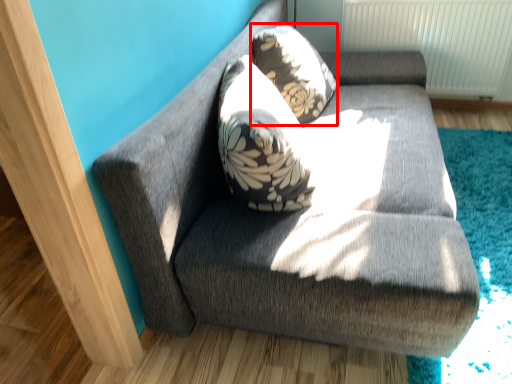
Question: From the image, what is the correct spatial relationship of throw pillow (annotated by the red box) in relation to studio couch?

Choices:
 (A) left
 (B) right

Answer: (A)